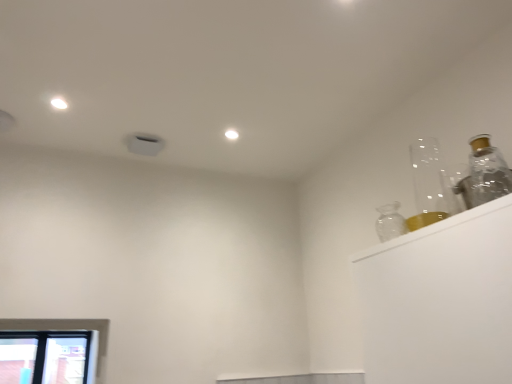
In order to face transparent glass bottle at upper right, should I rotate leftwards or rightwards?

It's best to rotate right around 29.930 degrees.

Describe the element at coordinates (484, 174) in the screenshot. I see `transparent glass bottle at upper right` at that location.

Where is `transparent glass bottle at upper right`? transparent glass bottle at upper right is located at coordinates click(x=484, y=174).

The width and height of the screenshot is (512, 384). Describe the element at coordinates (67, 329) in the screenshot. I see `clear glass window at lower left` at that location.

Measure the distance between point (x=62, y=329) and camera.

Point (x=62, y=329) is 1.96 meters away from camera.

Identify the location of clear glass window at lower left. The image size is (512, 384). (67, 329).

Find the location of a particular element. transparent glass bottle at upper right is located at coordinates tap(484, 174).

Considering the relative positions of transparent glass bottle at upper right and clear glass window at lower left in the image provided, is transparent glass bottle at upper right to the left or to the right of clear glass window at lower left?

In the image, transparent glass bottle at upper right appears on the right side of clear glass window at lower left.

Considering the relative positions of transparent glass bottle at upper right and clear glass window at lower left in the image provided, is transparent glass bottle at upper right in front of clear glass window at lower left?

Yes, it is in front of clear glass window at lower left.

Which is closer, (484,199) or (54,326)?

Answer: Point (484,199) appears to be closer to the viewer than point (54,326).

From the image's perspective, is transparent glass bottle at upper right beneath clear glass window at lower left?

No.

From a real-world perspective, which is physically below, transparent glass bottle at upper right or clear glass window at lower left?

clear glass window at lower left, from a real-world perspective.

Considering the relative sizes of transparent glass bottle at upper right and clear glass window at lower left in the image provided, is transparent glass bottle at upper right wider than clear glass window at lower left?

No, transparent glass bottle at upper right is not wider than clear glass window at lower left.

Considering the relative sizes of transparent glass bottle at upper right and clear glass window at lower left in the image provided, is transparent glass bottle at upper right shorter than clear glass window at lower left?

Correct, transparent glass bottle at upper right is not as tall as clear glass window at lower left.

Does transparent glass bottle at upper right have a smaller size compared to clear glass window at lower left?

Yes, transparent glass bottle at upper right is smaller than clear glass window at lower left.

Is clear glass window at lower left completely or partially inside transparent glass bottle at upper right?

No, transparent glass bottle at upper right does not contain clear glass window at lower left.

Is transparent glass bottle at upper right touching clear glass window at lower left?

transparent glass bottle at upper right is not next to clear glass window at lower left, and they're not touching.

Based on the photo, could you tell me if transparent glass bottle at upper right is turned towards clear glass window at lower left?

No, transparent glass bottle at upper right is not aimed at clear glass window at lower left.

Can you tell me how much transparent glass bottle at upper right and clear glass window at lower left differ in facing direction?

There is a 90.3-degree angle between the facing directions of transparent glass bottle at upper right and clear glass window at lower left.

Find the location of a particular element. The image size is (512, 384). bottle above the clear glass window at lower left (from a real-world perspective) is located at coordinates (484, 174).

Which object is positioned more to the right, clear glass window at lower left or transparent glass bottle at upper right?

transparent glass bottle at upper right.

Is clear glass window at lower left positioned before transparent glass bottle at upper right?

No, clear glass window at lower left is further to the viewer.

Is point (9, 327) positioned in front of point (473, 171)?

No, (9, 327) is behind (473, 171).

From the image's perspective, which object appears higher, clear glass window at lower left or transparent glass bottle at upper right?

transparent glass bottle at upper right appears higher in the image.

From a real-world perspective, is clear glass window at lower left physically below transparent glass bottle at upper right?

Indeed, from a real-world perspective, clear glass window at lower left is positioned beneath transparent glass bottle at upper right.

Based on the photo, between clear glass window at lower left and transparent glass bottle at upper right, which one has larger width?

With larger width is clear glass window at lower left.

Can you confirm if clear glass window at lower left is shorter than transparent glass bottle at upper right?

In fact, clear glass window at lower left may be taller than transparent glass bottle at upper right.

Which of these two, clear glass window at lower left or transparent glass bottle at upper right, is smaller?

Smaller between the two is transparent glass bottle at upper right.

Would you say clear glass window at lower left contains transparent glass bottle at upper right?

Definitely not — transparent glass bottle at upper right is not inside clear glass window at lower left.

Is clear glass window at lower left in contact with transparent glass bottle at upper right?

clear glass window at lower left and transparent glass bottle at upper right are clearly separated.

Could you tell me if clear glass window at lower left is turned towards transparent glass bottle at upper right?

Yes, clear glass window at lower left is oriented towards transparent glass bottle at upper right.

How different are the orientations of clear glass window at lower left and transparent glass bottle at upper right in degrees?

The angle between the facing direction of clear glass window at lower left and the facing direction of transparent glass bottle at upper right is 90.3 degrees.

The image size is (512, 384). I want to click on window directly beneath the transparent glass bottle at upper right (from a real-world perspective), so coord(67,329).

Where is `window located below the transparent glass bottle at upper right (from the image's perspective)`? The image size is (512, 384). window located below the transparent glass bottle at upper right (from the image's perspective) is located at coordinates (67, 329).

You are a GUI agent. You are given a task and a screenshot of the screen. Output one action in this format:
    pyautogui.click(x=<x>, y=<y>)
    Task: Click on the bottle above the clear glass window at lower left (from the image's perspective)
    This screenshot has width=512, height=384.
    Given the screenshot: What is the action you would take?
    pyautogui.click(x=484, y=174)